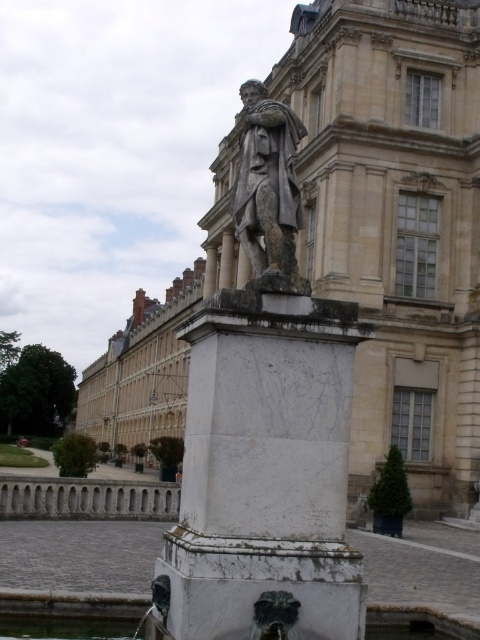
Question: Among these objects, which one is farthest from the camera?

Choices:
 (A) white marble pedestal at center
 (B) marble statue at center

Answer: (B)

Question: Does marble statue at center have a larger size compared to gray stone statue at center?

Choices:
 (A) no
 (B) yes

Answer: (B)

Question: Considering the relative positions of marble statue at center and white marble pedestal at center in the image provided, where is marble statue at center located with respect to white marble pedestal at center?

Choices:
 (A) right
 (B) left

Answer: (B)

Question: Which of these objects is positioned closest to the white marble pedestal at center?

Choices:
 (A) marble statue at center
 (B) gray stone statue at center

Answer: (B)

Question: Which point appears closest to the camera in this image?

Choices:
 (A) (233, 236)
 (B) (276, 109)

Answer: (B)

Question: Is white marble pedestal at center thinner than gray stone statue at center?

Choices:
 (A) no
 (B) yes

Answer: (A)